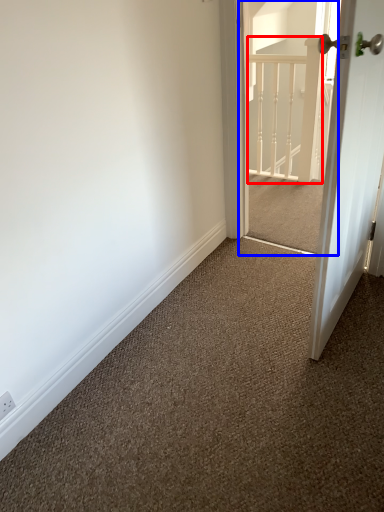
Question: Among these objects, which one is nearest to the camera, rail (highlighted by a red box) or screen door (highlighted by a blue box)?

Choices:
 (A) rail
 (B) screen door

Answer: (B)